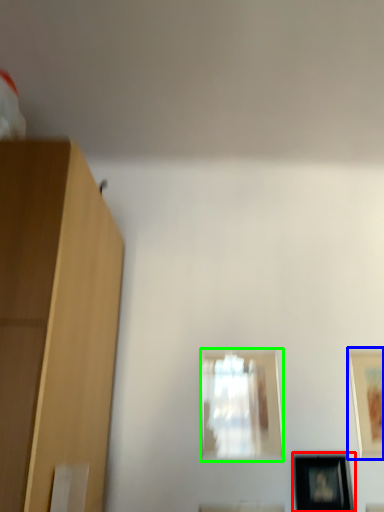
Question: Based on their relative distances, which object is farther from picture frame (highlighted by a red box)? Choose from picture frame (highlighted by a blue box) and picture frame (highlighted by a green box).

Choices:
 (A) picture frame
 (B) picture frame

Answer: (B)